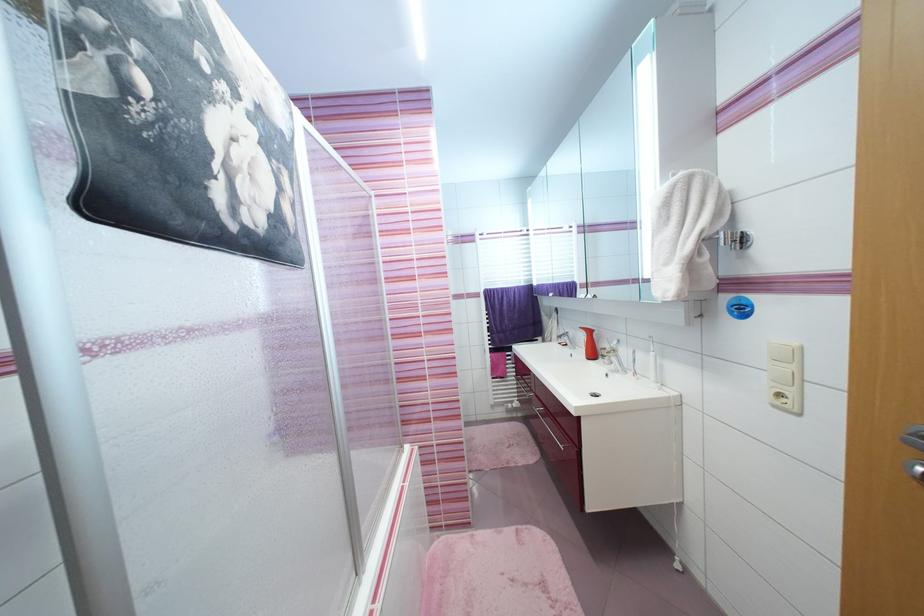
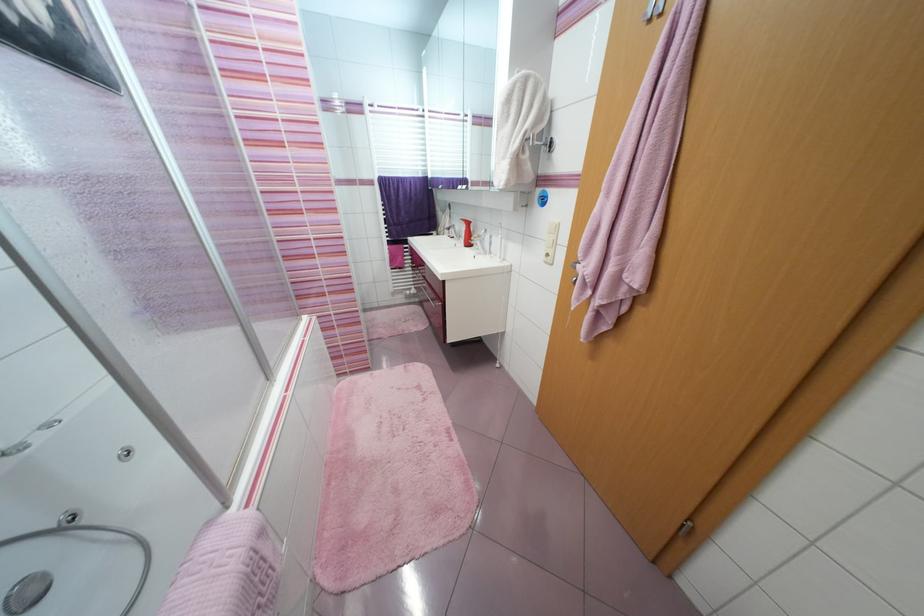
Where in the second image is the point corresponding to [781,408] from the first image?

(551, 264)